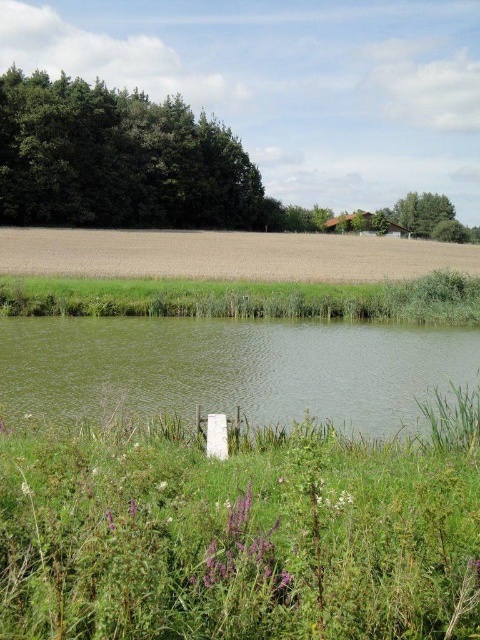
Which of these two, green water at center or brown matte field at center, stands shorter?

Standing shorter between the two is green water at center.

Is point (95, 339) positioned after point (303, 259)?

No, it is not.

Where is `green water at center`? green water at center is located at coordinates (231, 369).

Does green water at center have a smaller size compared to green leafy trees at upper left?

Yes.

Between point (360, 419) and point (116, 109), which one is positioned behind?

The point (116, 109) is more distant.

Identify the location of green water at center. Image resolution: width=480 pixels, height=640 pixels. (231, 369).

From the picture: Which of these two, green grassy patch at lower left or green leafy trees at upper left, stands taller?

With more height is green leafy trees at upper left.

Can you confirm if green grassy patch at lower left is thinner than green leafy trees at upper left?

Indeed, green grassy patch at lower left has a lesser width compared to green leafy trees at upper left.

Find the location of `green grassy patch at lower left`. green grassy patch at lower left is located at coordinates (236, 540).